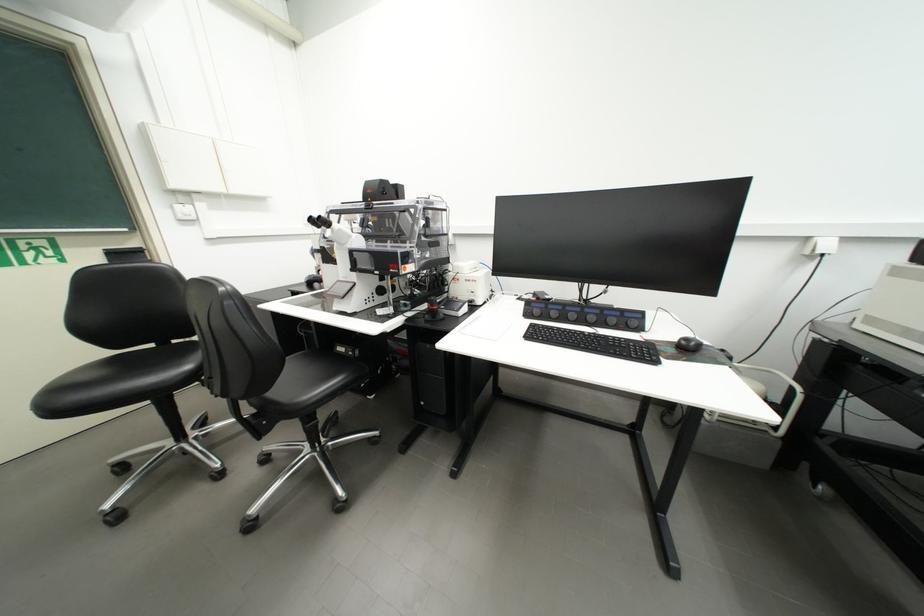
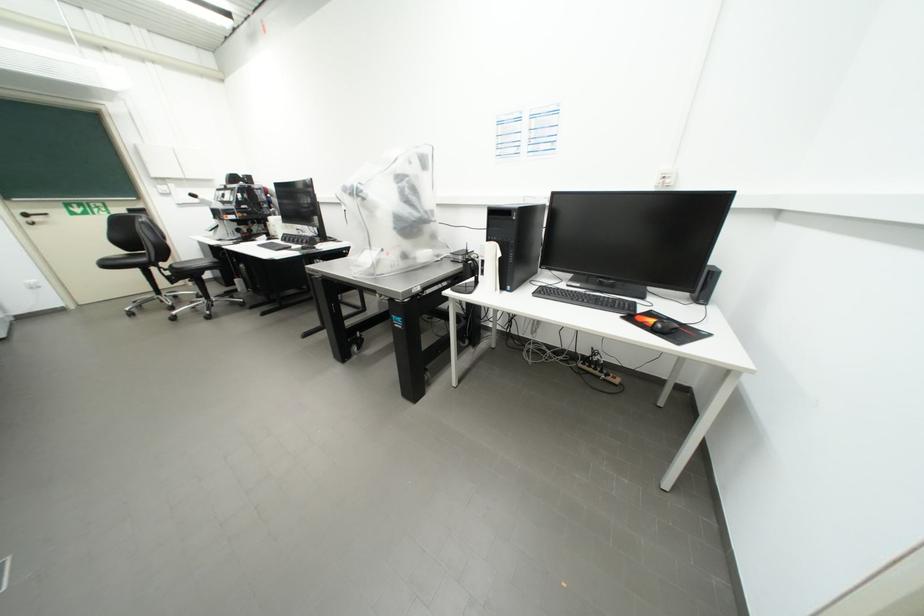
Where in the second image is the point corresponding to the point at 175,445 from the first image?

(160, 296)